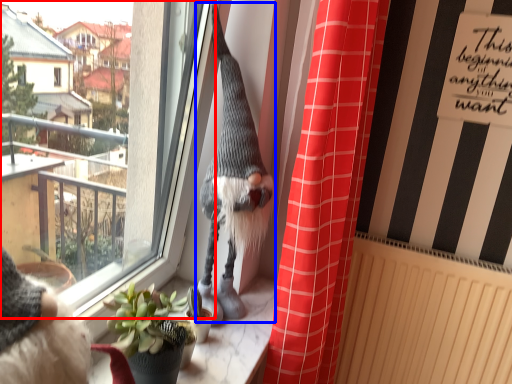
Question: Which of the following is the farthest to the observer, window (highlighted by a red box) or animal (highlighted by a blue box)?

Choices:
 (A) window
 (B) animal

Answer: (B)